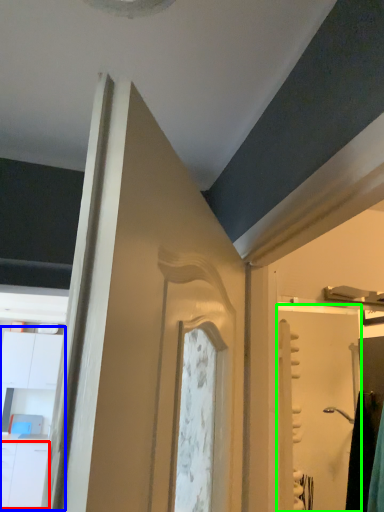
Question: Which is farther away from drawer (highlighted by a red box)? dresser (highlighted by a blue box) or screen door (highlighted by a green box)?

Choices:
 (A) dresser
 (B) screen door

Answer: (B)